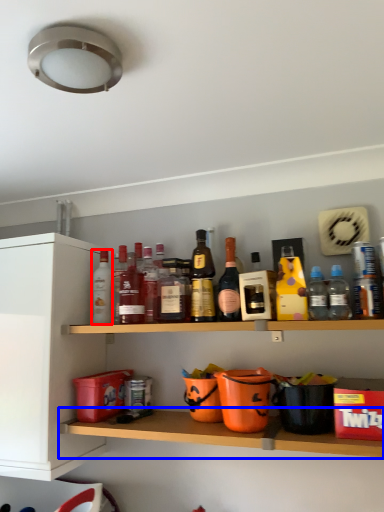
Question: Which object appears farthest to the camera in this image, bottle (highlighted by a red box) or shelf (highlighted by a blue box)?

Choices:
 (A) bottle
 (B) shelf

Answer: (A)